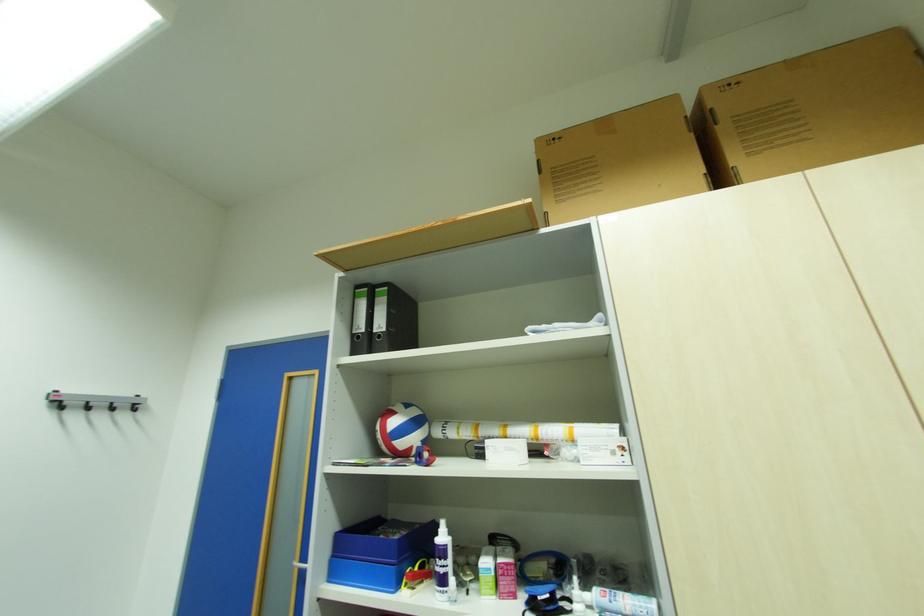
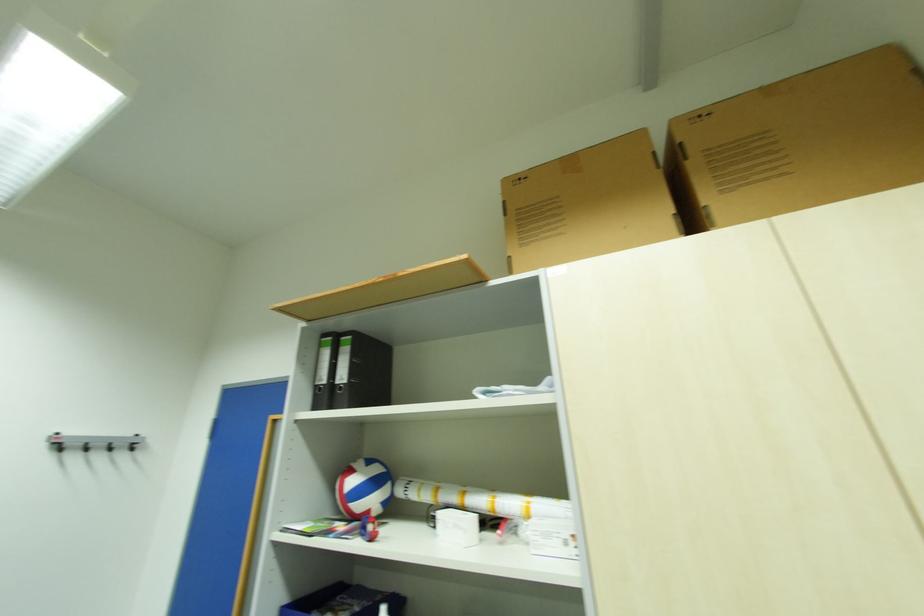
Question: The first image is from the beginning of the video and the second image is from the end. How did the camera likely rotate when shooting the video?

Choices:
 (A) Left
 (B) Right
 (C) Up
 (D) Down

Answer: (A)